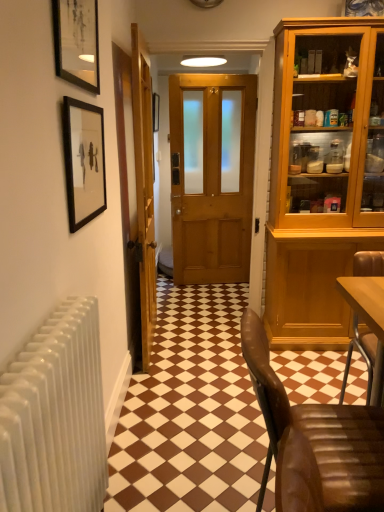
Where is `vacant space to the right of wooden door at center, positioned as the first door in left-to-right order`? vacant space to the right of wooden door at center, positioned as the first door in left-to-right order is located at coordinates (198, 340).